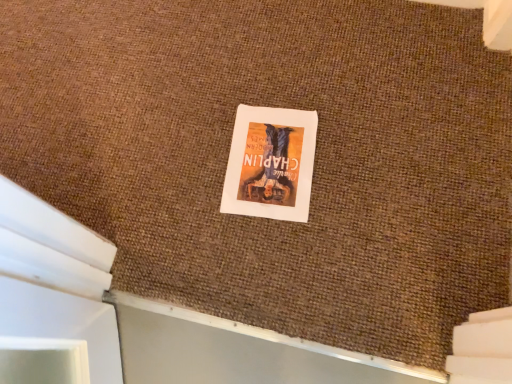
Where is `vacant area that is in front of matte paper poster at center`? The image size is (512, 384). vacant area that is in front of matte paper poster at center is located at coordinates (291, 258).